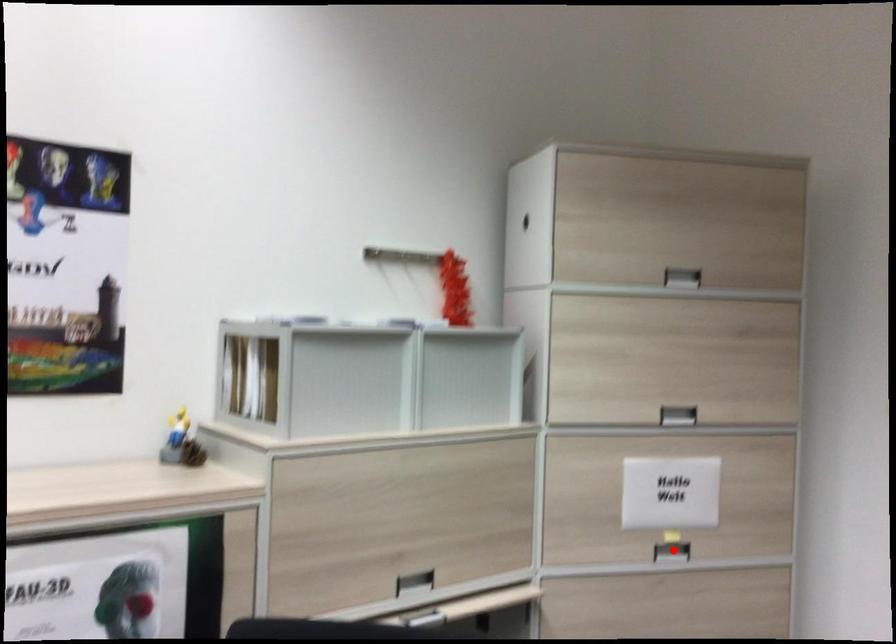
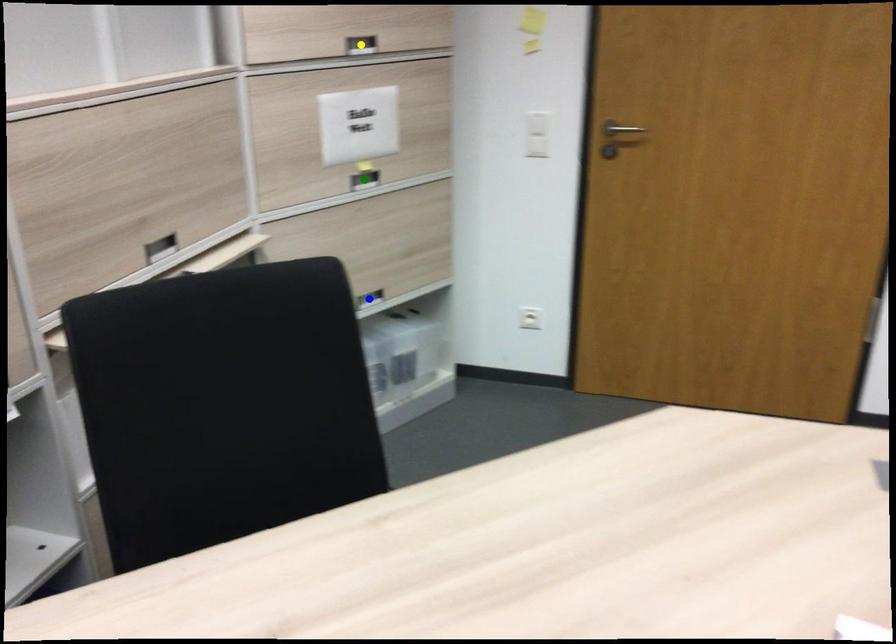
Question: I am providing you with two images of the same scene from different viewpoints. A red point is marked on the first image. You are given multiple points on the second image. Which point in image 2 represents the same 3d spot as the red point in image 1?

Choices:
 (A) green point
 (B) yellow point
 (C) blue point

Answer: (A)